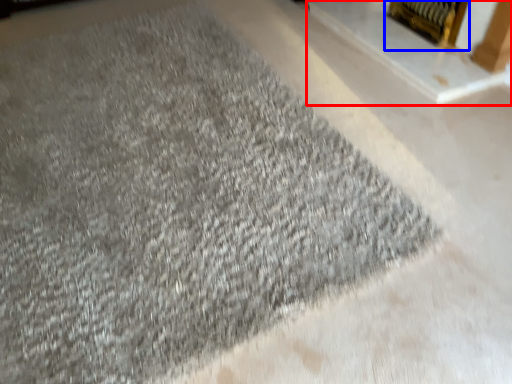
Question: Which point is further to the camera, fireplace (highlighted by a red box) or fireplace (highlighted by a blue box)?

Choices:
 (A) fireplace
 (B) fireplace

Answer: (B)